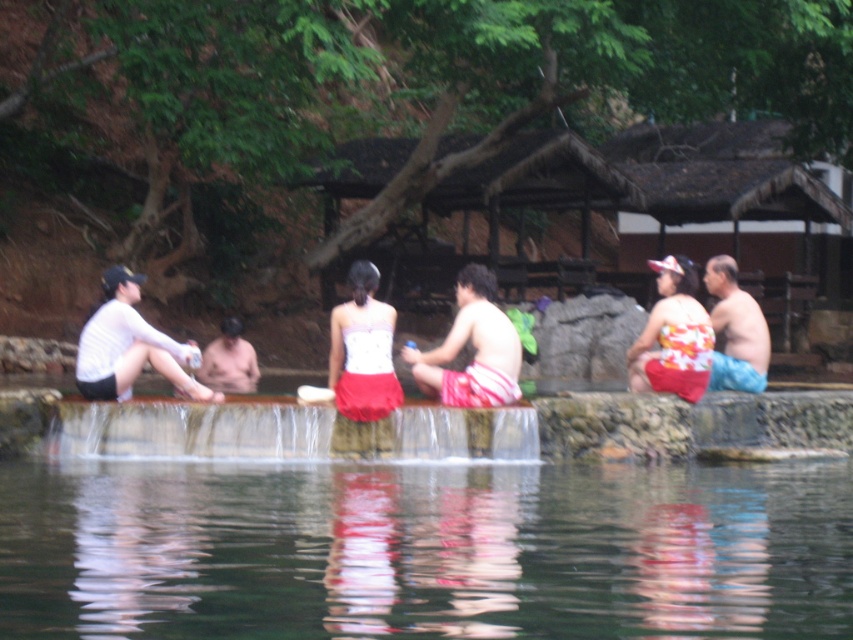
Question: Based on their relative distances, which object is nearer to the reddish-pink fabric shorts at center?

Choices:
 (A) blue fabric shorts at right
 (B) smooth skin man at center
 (C) transparent water at center

Answer: (A)

Question: Which object appears farthest from the camera in this image?

Choices:
 (A) reddish-pink fabric shorts at center
 (B) blue fabric shorts at right

Answer: (B)

Question: Can you confirm if transparent water at center is positioned above smooth skin man at center?

Choices:
 (A) no
 (B) yes

Answer: (A)

Question: Does transparent water at center have a smaller size compared to smooth skin man at center?

Choices:
 (A) no
 (B) yes

Answer: (B)

Question: Is reddish-pink fabric shorts at center bigger than smooth skin man at center?

Choices:
 (A) no
 (B) yes

Answer: (A)

Question: Considering the real-world distances, which object is closest to the blue fabric shorts at right?

Choices:
 (A) smooth skin man at center
 (B) reddish-pink fabric shorts at center
 (C) transparent water at center

Answer: (B)